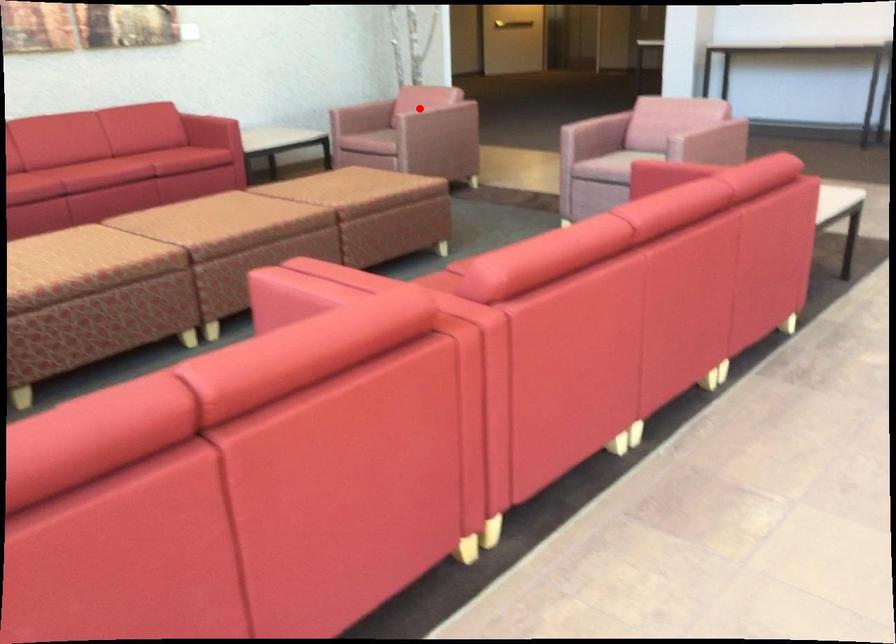
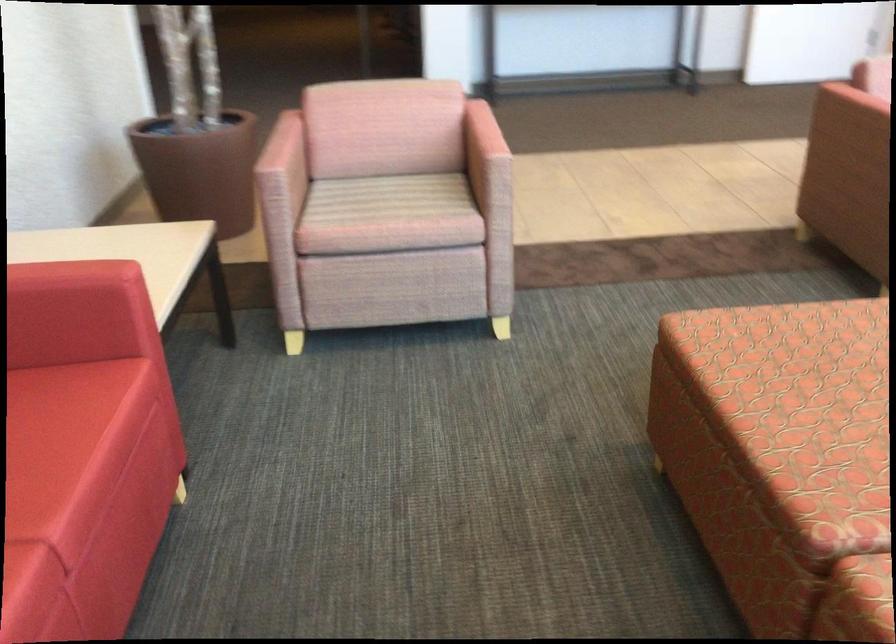
The point at the highlighted location is marked in the first image. Where is the corresponding point in the second image?

(481, 133)